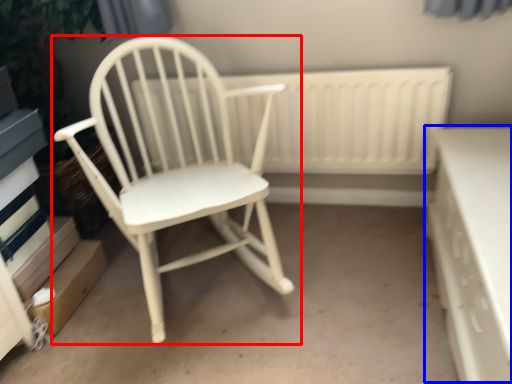
Question: Which point is closer to the camera, chair (highlighted by a red box) or table (highlighted by a blue box)?

Choices:
 (A) chair
 (B) table

Answer: (B)